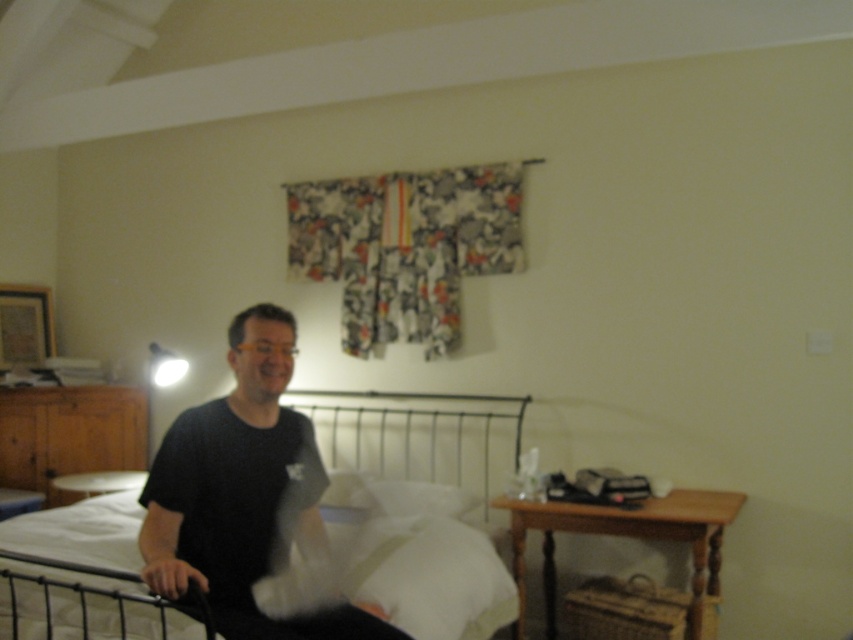
Question: Does white fabric bed at center have a larger size compared to white soft pillow at center?

Choices:
 (A) yes
 (B) no

Answer: (A)

Question: Can you confirm if black matte shirt at center is thinner than white fabric bed at center?

Choices:
 (A) yes
 (B) no

Answer: (A)

Question: Which point is farther to the camera?

Choices:
 (A) (370, 496)
 (B) (227, 460)
 (C) (425, 566)

Answer: (A)

Question: Does black matte shirt at center have a smaller size compared to white soft pillow at center?

Choices:
 (A) no
 (B) yes

Answer: (A)

Question: Among these objects, which one is farthest from the camera?

Choices:
 (A) white fabric bed at center
 (B) black matte shirt at center
 (C) white soft pillow at center

Answer: (C)

Question: Which point is farther to the camera?

Choices:
 (A) white fabric bed at center
 (B) white soft pillow at center
 (C) black matte shirt at center

Answer: (B)